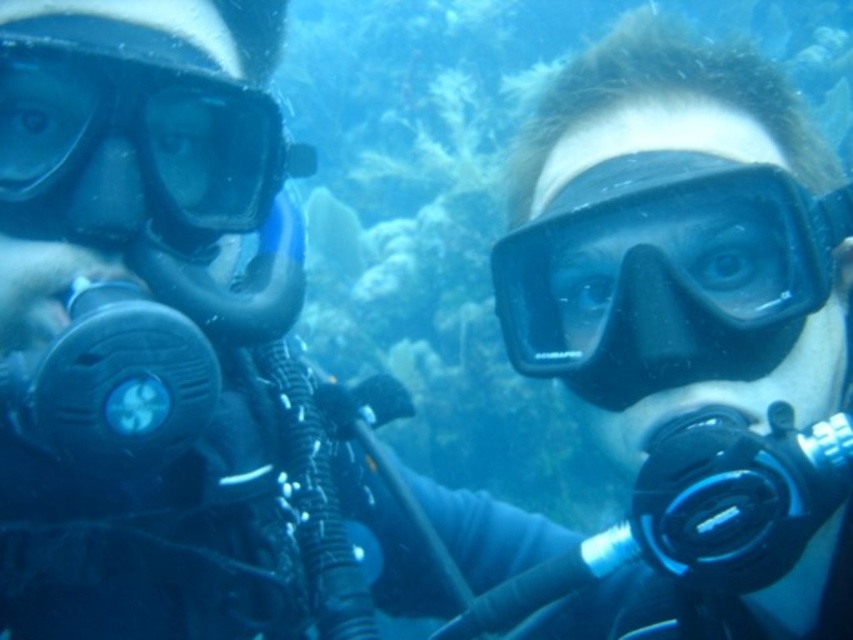
Is point (650, 324) positioned behind point (161, 179)?

No, (650, 324) is in front of (161, 179).

Can you confirm if black matte scuba mask at right is positioned to the left of transparent rubber goggles at left?

Incorrect, black matte scuba mask at right is not on the left side of transparent rubber goggles at left.

At what (x,y) coordinates should I click in order to perform the action: click on black matte scuba mask at right. Please return your answer as a coordinate pair (x, y). Looking at the image, I should click on (665, 275).